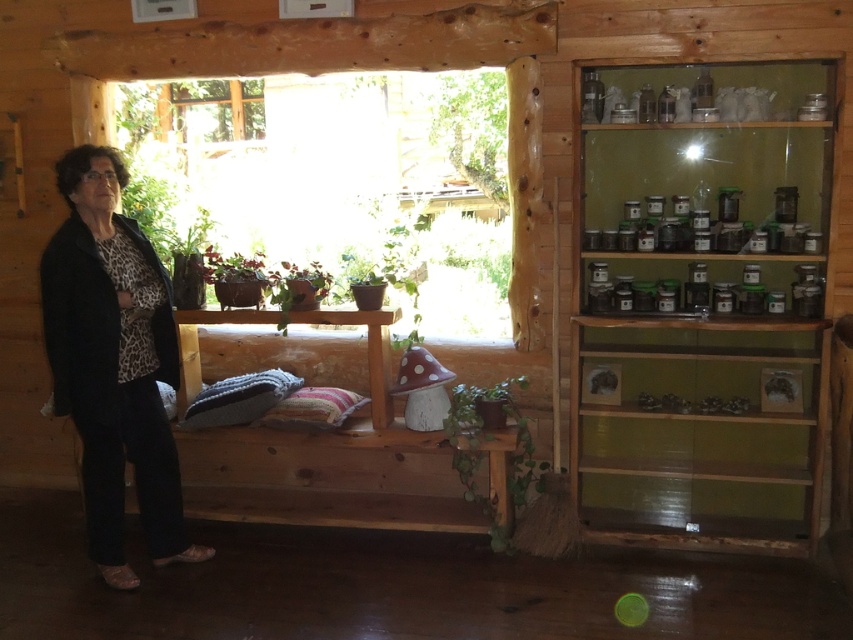
Question: Which is farther from the leopard print fabric at left?

Choices:
 (A) clear glass shelves at upper right
 (B) matte brown pot at center

Answer: (A)

Question: In this image, where is clear glass jars at upper right located relative to green leafy plant at lower center?

Choices:
 (A) left
 (B) right

Answer: (B)

Question: Does clear glass shelves at upper right appear on the right side of green leafy plant at lower center?

Choices:
 (A) yes
 (B) no

Answer: (A)

Question: Which object is the farthest from the leopard print fabric at left?

Choices:
 (A) transparent glass window at center
 (B) clear glass shelves at upper right

Answer: (B)

Question: Is leopard print fabric at left to the right of green leafy plant at lower center from the viewer's perspective?

Choices:
 (A) no
 (B) yes

Answer: (A)

Question: Among these points, which one is nearest to the camera?

Choices:
 (A) 622,266
 (B) 144,291
 (C) 230,285
 (D) 448,428

Answer: (B)